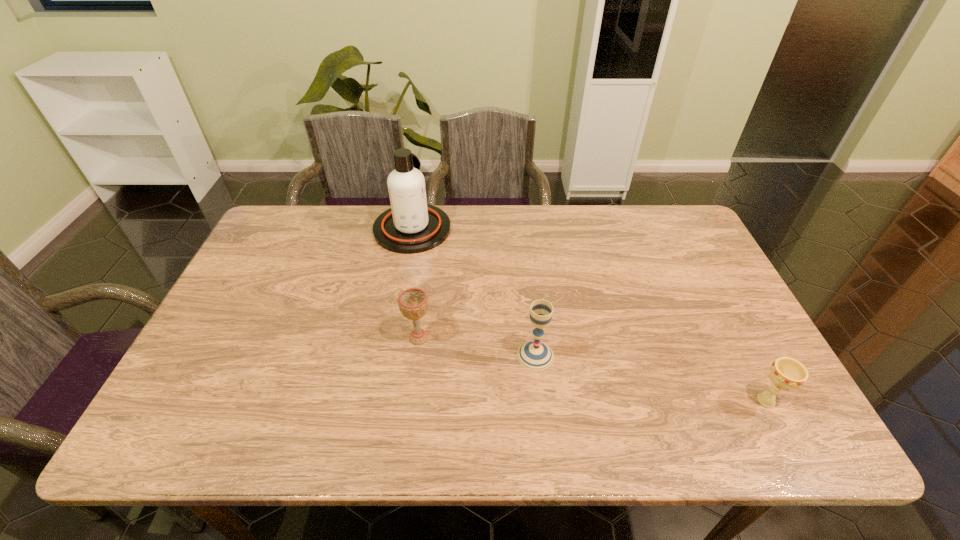
Identify the location of cleansing agent. (410, 226).

At what (x,y) coordinates should I click in order to perform the action: click on the farthest object. Please return your answer as a coordinate pair (x, y). Looking at the image, I should click on (410, 226).

You are a GUI agent. You are given a task and a screenshot of the screen. Output one action in this format:
    pyautogui.click(x=<x>, y=<y>)
    Task: Click on the second chalice from right to left
    
    Given the screenshot: What is the action you would take?
    pyautogui.click(x=535, y=355)

Image resolution: width=960 pixels, height=540 pixels. Identify the location of the leftmost chalice. (413, 302).

Locate an element on the screen. This screenshot has width=960, height=540. the nearest object is located at coordinates (786, 373).

The height and width of the screenshot is (540, 960). Find the location of `the rightmost chalice`. the rightmost chalice is located at coordinates (786, 373).

Where is `free space located 0.150m on the front of the tallest object`? This screenshot has width=960, height=540. free space located 0.150m on the front of the tallest object is located at coordinates (401, 288).

I want to click on blank area located 0.220m on the left of the second object from right to left, so 428,355.

Where is `vacant region located 0.170m on the left of the leftmost chalice`? vacant region located 0.170m on the left of the leftmost chalice is located at coordinates (338, 338).

The width and height of the screenshot is (960, 540). What are the coordinates of `vacant space located 0.380m on the back of the shortest chalice` in the screenshot? It's located at (701, 275).